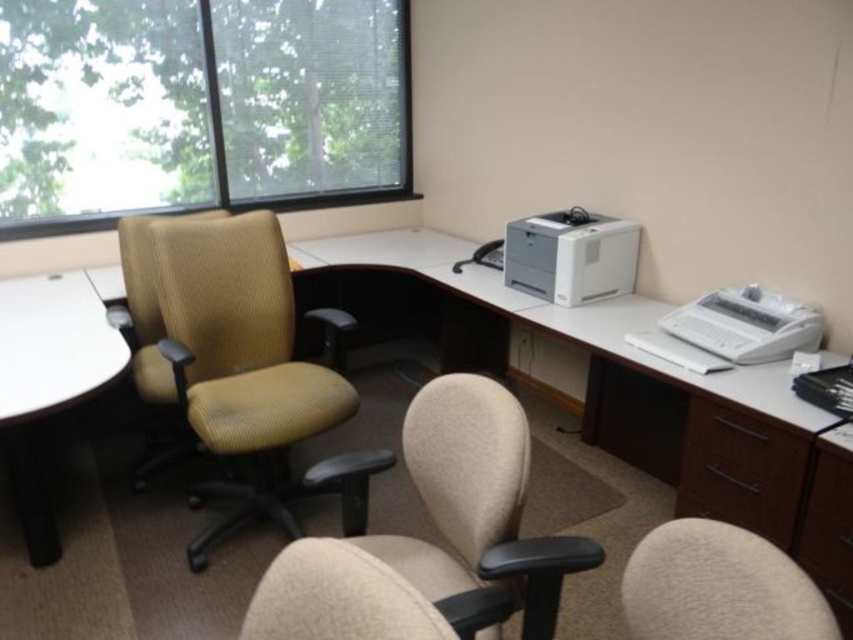
Question: Is beige fabric office chair at left wider than white plastic printer at right?

Choices:
 (A) no
 (B) yes

Answer: (B)

Question: Estimate the real-world distances between objects in this image. Which object is farther from the beige fabric office chair at left?

Choices:
 (A) white plastic printer at right
 (B) beige fabric swivel chair at lower right

Answer: (B)

Question: Is beige fabric office chair at left below white matte computer desk at center?

Choices:
 (A) no
 (B) yes

Answer: (A)

Question: Which object appears farthest from the camera in this image?

Choices:
 (A) white matte round table at left
 (B) beige fabric swivel chair at lower right
 (C) brown wood drawer at lower right
 (D) white plastic printer at right

Answer: (D)

Question: Which of these objects is positioned farthest from the white plastic printer at right?

Choices:
 (A) transparent glass window at upper left
 (B) white matte printer at upper right

Answer: (A)

Question: From the image, what is the correct spatial relationship of white matte computer desk at center in relation to white matte printer at upper right?

Choices:
 (A) above
 (B) below

Answer: (B)